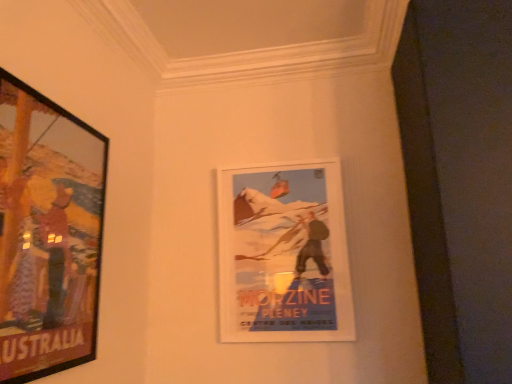
Question: Is white paper poster at center, which ranks as the first picture frame in back-to-front order, taller or shorter than wooden-framed poster at left, positioned as the second picture frame in back-to-front order?

Choices:
 (A) short
 (B) tall

Answer: (A)

Question: Would you say white paper poster at center, arranged as the 2th picture frame when viewed from the front, is to the left or to the right of wooden-framed poster at left, positioned as the second picture frame in back-to-front order, in the picture?

Choices:
 (A) left
 (B) right

Answer: (B)

Question: From the image's perspective, is white paper poster at center, which appears as the 1th picture frame when viewed from the right, positioned above or below wooden-framed poster at left, positioned as the second picture frame in back-to-front order?

Choices:
 (A) above
 (B) below

Answer: (B)

Question: Relative to white paper poster at center, which ranks as the first picture frame in back-to-front order, is wooden-framed poster at left, the first picture frame in the front-to-back sequence, in front or behind?

Choices:
 (A) behind
 (B) front

Answer: (B)

Question: Is wooden-framed poster at left, the first picture frame in the front-to-back sequence, taller or shorter than white paper poster at center, which ranks as the first picture frame in back-to-front order?

Choices:
 (A) tall
 (B) short

Answer: (A)

Question: Considering the positions of wooden-framed poster at left, the first picture frame in the front-to-back sequence, and white paper poster at center, positioned as the second picture frame in left-to-right order, in the image, is wooden-framed poster at left, the first picture frame in the front-to-back sequence, bigger or smaller than white paper poster at center, positioned as the second picture frame in left-to-right order,?

Choices:
 (A) small
 (B) big

Answer: (B)

Question: From a real-world perspective, relative to white paper poster at center, which appears as the 1th picture frame when viewed from the right, is wooden-framed poster at left, the 2th picture frame when ordered from right to left, vertically above or below?

Choices:
 (A) below
 (B) above

Answer: (B)